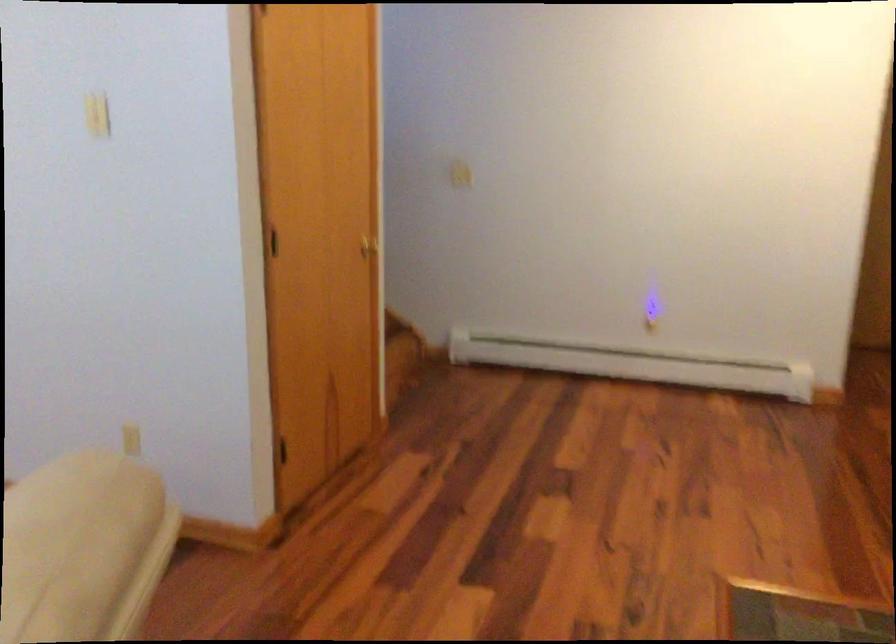
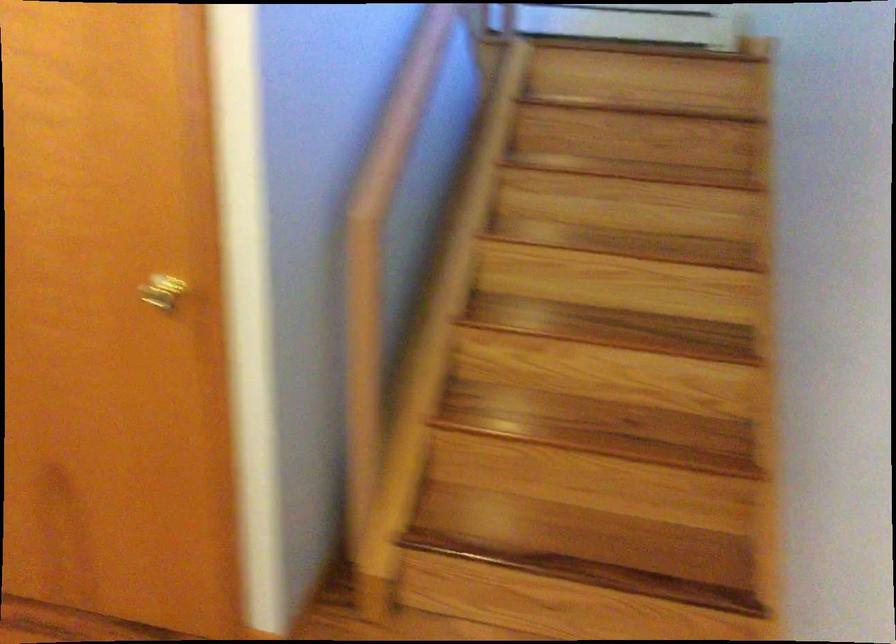
The first image is from the beginning of the video and the second image is from the end. How did the camera likely rotate when shooting the video?

The camera rotated toward right-down.